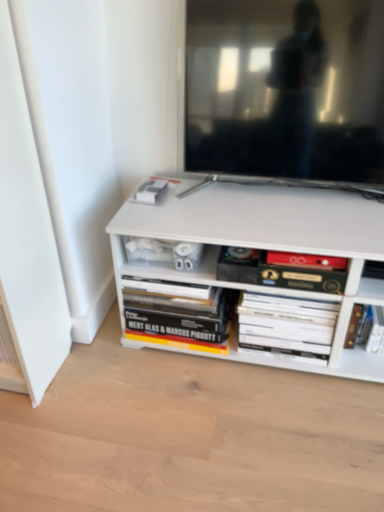
You are a GUI agent. You are given a task and a screenshot of the screen. Output one action in this format:
    pyautogui.click(x=<x>, y=<y>)
    Task: Click on the vacant area situated to the left side of white matte book at center, which is the 2th book from right to left
    
    Given the screenshot: What is the action you would take?
    pyautogui.click(x=210, y=370)